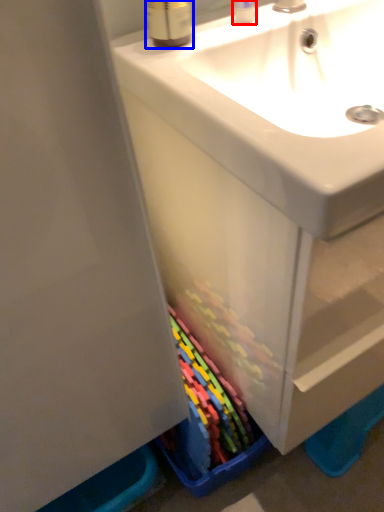
Question: Among these objects, which one is farthest to the camera, toiletry (highlighted by a red box) or mouthwash (highlighted by a blue box)?

Choices:
 (A) toiletry
 (B) mouthwash

Answer: (A)